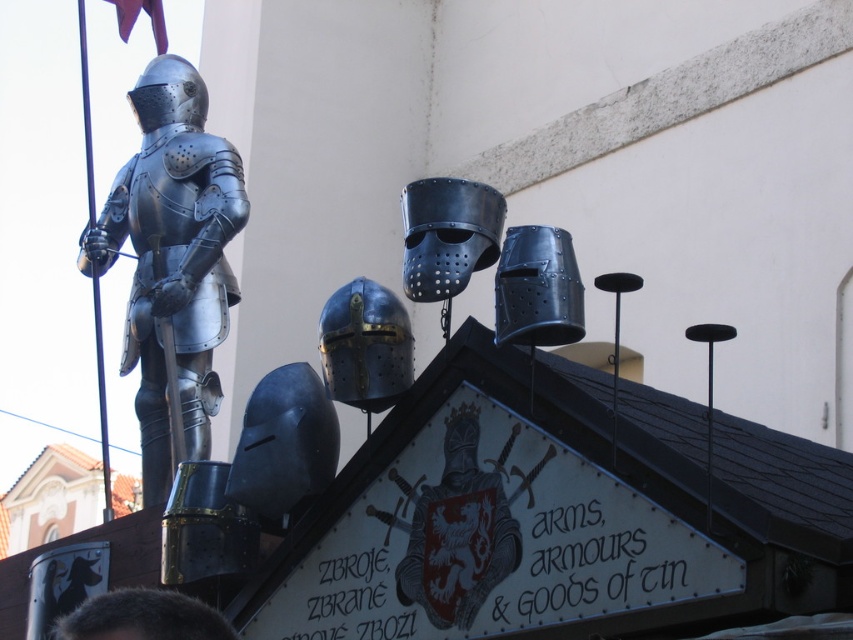
Question: Is shiny metallic helmet at center to the left of shiny silver helmet at upper left from the viewer's perspective?

Choices:
 (A) no
 (B) yes

Answer: (A)

Question: Which object is positioned closest to the metallic blue helmet at center?

Choices:
 (A) shiny silver helmet at upper left
 (B) shiny silver armor at left
 (C) shiny metallic helmet at lower left

Answer: (C)

Question: Which object appears closest to the camera in this image?

Choices:
 (A) shiny metallic helmet at center
 (B) shiny silver helmet at upper left
 (C) metallic blue helmet at center

Answer: (A)

Question: Does black leather helmet at center have a smaller size compared to shiny metallic helmet at center?

Choices:
 (A) yes
 (B) no

Answer: (B)

Question: Can you confirm if shiny silver armor at left is bigger than shiny silver helmet at upper left?

Choices:
 (A) yes
 (B) no

Answer: (A)

Question: Which point is farther from the camera taking this photo?

Choices:
 (A) (476, 195)
 (B) (485, 524)

Answer: (A)